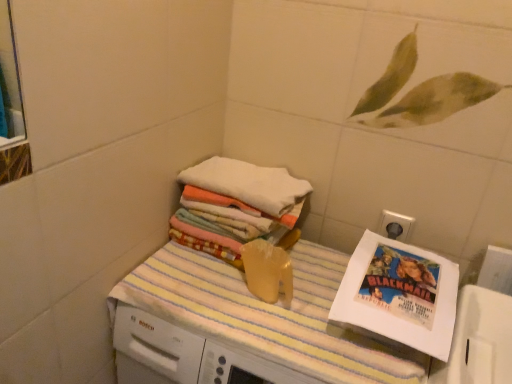
Question: From a real-world perspective, does white paper comic book at right sit lower than yellow striped towel at center?

Choices:
 (A) no
 (B) yes

Answer: (A)

Question: Can you confirm if white paper comic book at right is positioned to the left of yellow striped towel at center?

Choices:
 (A) yes
 (B) no

Answer: (B)

Question: Considering the relative sizes of white paper comic book at right and yellow striped towel at center in the image provided, is white paper comic book at right taller than yellow striped towel at center?

Choices:
 (A) no
 (B) yes

Answer: (A)

Question: Is white paper comic book at right closer to camera compared to yellow striped towel at center?

Choices:
 (A) yes
 (B) no

Answer: (B)

Question: Considering the relative sizes of white paper comic book at right and yellow striped towel at center in the image provided, is white paper comic book at right thinner than yellow striped towel at center?

Choices:
 (A) yes
 (B) no

Answer: (A)

Question: Is white paper comic book at right smaller than yellow striped towel at center?

Choices:
 (A) yes
 (B) no

Answer: (A)

Question: From the image's perspective, is yellow striped towel at center on white soft towels at upper center?

Choices:
 (A) yes
 (B) no

Answer: (B)

Question: Would you say yellow striped towel at center is outside white soft towels at upper center?

Choices:
 (A) yes
 (B) no

Answer: (A)

Question: Does yellow striped towel at center have a lesser width compared to white soft towels at upper center?

Choices:
 (A) yes
 (B) no

Answer: (B)

Question: Does yellow striped towel at center turn towards white soft towels at upper center?

Choices:
 (A) no
 (B) yes

Answer: (A)

Question: Is yellow striped towel at center facing away from white soft towels at upper center?

Choices:
 (A) yes
 (B) no

Answer: (B)

Question: Considering the relative positions of yellow striped towel at center and white soft towels at upper center in the image provided, is yellow striped towel at center behind white soft towels at upper center?

Choices:
 (A) no
 (B) yes

Answer: (A)

Question: Considering the relative sizes of white paper comic book at right and white soft towels at upper center in the image provided, is white paper comic book at right wider than white soft towels at upper center?

Choices:
 (A) no
 (B) yes

Answer: (A)